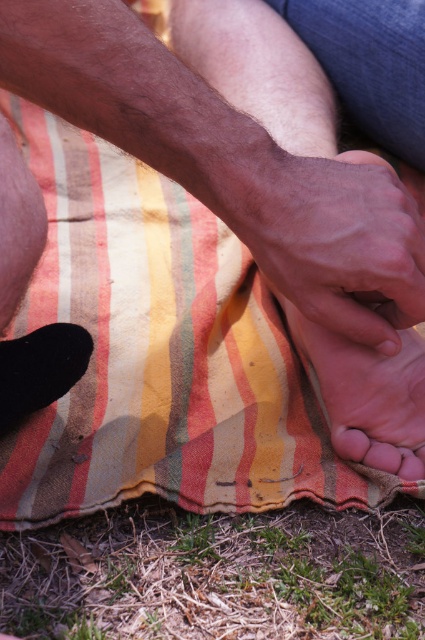
Does pink soft skin at center appear on the left side of pink smooth toe at center?

Indeed, pink soft skin at center is positioned on the left side of pink smooth toe at center.

Identify the location of pink soft skin at center. The height and width of the screenshot is (640, 425). (410, 461).

Locate an element on the screen. dry skin at center is located at coordinates (345, 246).

Does point (286, 202) come behind point (342, 429)?

No, it is not.

Identify the location of dry skin at center. (345, 246).

Image resolution: width=425 pixels, height=640 pixels. Find the location of `green grass at lower center`. green grass at lower center is located at coordinates (218, 573).

Does point (411, 515) come behind point (391, 464)?

Yes, it is behind point (391, 464).

At what (x,y) coordinates should I click in order to perform the action: click on green grass at lower center. Please return your answer as a coordinate pair (x, y). The image size is (425, 640). Looking at the image, I should click on (218, 573).